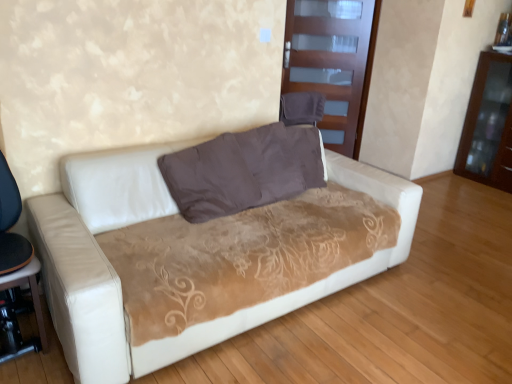
Find the location of a particular element. This screenshot has width=512, height=384. brown suede pillow at center is located at coordinates (283, 160).

This screenshot has height=384, width=512. What do you see at coordinates (333, 62) in the screenshot?
I see `transparent glass door at upper center` at bounding box center [333, 62].

Measure the distance between point (328, 104) and camera.

A distance of 4.40 meters exists between point (328, 104) and camera.

The image size is (512, 384). What do you see at coordinates (488, 124) in the screenshot?
I see `brown glossy dresser at right` at bounding box center [488, 124].

Identify the location of white leather couch at center. (199, 257).

The image size is (512, 384). I want to click on brown suede pillow at center, so click(283, 160).

Between point (395, 259) and point (318, 150), which one is positioned in front?

The point (395, 259) is closer.

Is white leather couch at center further to camera compared to brown suede pillow at center?

No, white leather couch at center is closer to the viewer.

In terms of width, does white leather couch at center look wider or thinner when compared to brown suede pillow at center?

Considering their sizes, white leather couch at center looks broader than brown suede pillow at center.

From a real-world perspective, which is physically above, white leather couch at center or brown suede pillow at center?

In real-world perspective, brown suede pillow at center is above.

Does brown suede pillow at center have a lesser width compared to white leather couch at center?

Yes, brown suede pillow at center is thinner than white leather couch at center.

Is brown suede pillow at center facing away from white leather couch at center?

Yes.

Does point (305, 131) come closer to viewer compared to point (65, 171)?

No, it is behind (65, 171).

Which is more to the left, brown glossy dresser at right or transparent glass door at upper center?

transparent glass door at upper center.

You are a GUI agent. You are given a task and a screenshot of the screen. Output one action in this format:
    pyautogui.click(x=<x>, y=<y>)
    Task: Click on the dresser in front of the transparent glass door at upper center
    
    Given the screenshot: What is the action you would take?
    pyautogui.click(x=488, y=124)

Between brown glossy dresser at right and transparent glass door at upper center, which one has more height?

Standing taller between the two is transparent glass door at upper center.

Does white leather couch at center lie behind transparent glass door at upper center?

No.

Is white leather couch at center spatially inside transparent glass door at upper center, or outside of it?

white leather couch at center cannot be found inside transparent glass door at upper center.

This screenshot has height=384, width=512. Identify the location of studio couch lying below the transparent glass door at upper center (from the image's perspective). (199, 257).

Is white leather couch at center positioned with its back to transparent glass door at upper center?

No.

Where is `table in front of the brown glossy dresser at right`? This screenshot has width=512, height=384. table in front of the brown glossy dresser at right is located at coordinates (19, 285).

Is brown glossy dresser at right looking in the opposite direction of black plastic table at lower left?

brown glossy dresser at right is not turned away from black plastic table at lower left.

In the scene shown: What's the angular difference between brown glossy dresser at right and black plastic table at lower left's facing directions?

The facing directions of brown glossy dresser at right and black plastic table at lower left are 92.9 degrees apart.

Considering the sizes of objects brown glossy dresser at right and black plastic table at lower left in the image provided, who is taller, brown glossy dresser at right or black plastic table at lower left?

brown glossy dresser at right.

Is transparent glass door at upper center looking in the opposite direction of brown suede pillow at center?

No, transparent glass door at upper center is not facing the opposite direction of brown suede pillow at center.

Which is in front, point (312, 18) or point (295, 181)?

The point (295, 181) is more forward.

From a real-world perspective, between transparent glass door at upper center and brown suede pillow at center, who is vertically lower?

brown suede pillow at center.

Is transparent glass door at upper center far away from brown suede pillow at center?

transparent glass door at upper center is positioned a significant distance from brown suede pillow at center.

Considering the relative sizes of black plastic table at lower left and transparent glass door at upper center in the image provided, is black plastic table at lower left shorter than transparent glass door at upper center?

Yes.

Is black plastic table at lower left oriented away from transparent glass door at upper center?

That's not correct — black plastic table at lower left is not looking away from transparent glass door at upper center.

Is black plastic table at lower left completely or partially outside of transparent glass door at upper center?

Yes, black plastic table at lower left is outside of transparent glass door at upper center.

The height and width of the screenshot is (384, 512). What are the coordinates of `studio couch below the brown suede pillow at center (from a real-world perspective)` in the screenshot? It's located at (199, 257).

The height and width of the screenshot is (384, 512). I want to click on studio couch below the brown suede pillow at center (from the image's perspective), so click(199, 257).

Which object lies further to the anchor point brown glossy dresser at right, white leather couch at center or brown suede pillow at center?

Based on the image, white leather couch at center appears to be further to brown glossy dresser at right.

Which object lies further to the anchor point brown suede pillow at center, white leather couch at center or black plastic table at lower left?

black plastic table at lower left.

Based on their spatial positions, is transparent glass door at upper center or black plastic table at lower left further from brown glossy dresser at right?

Among the two, black plastic table at lower left is located further to brown glossy dresser at right.

Based on the photo, considering their positions, is transparent glass door at upper center positioned further to black plastic table at lower left than white leather couch at center?

transparent glass door at upper center.

From the picture: From the image, which object appears to be farther from white leather couch at center, brown suede pillow at center or brown glossy dresser at right?

brown glossy dresser at right lies further to white leather couch at center than the other object.

Considering their positions, is brown suede pillow at center positioned closer to transparent glass door at upper center than white leather couch at center?

→ The object closer to transparent glass door at upper center is brown suede pillow at center.

Consider the image. Based on their spatial positions, is brown glossy dresser at right or black plastic table at lower left further from white leather couch at center?

brown glossy dresser at right is further to white leather couch at center.

Considering their positions, is white leather couch at center positioned further to black plastic table at lower left than brown glossy dresser at right?

Based on the image, brown glossy dresser at right appears to be further to black plastic table at lower left.

Locate an element on the screen. glass door between brown suede pillow at center and brown glossy dresser at right from left to right is located at coordinates pos(333,62).

You are a GUI agent. You are given a task and a screenshot of the screen. Output one action in this format:
    pyautogui.click(x=<x>, y=<y>)
    Task: Click on the pillow between white leather couch at center and transparent glass door at upper center from front to back
    The width and height of the screenshot is (512, 384).
    Given the screenshot: What is the action you would take?
    pyautogui.click(x=283, y=160)

Find the location of `glass door between black plastic table at lower left and brown glossy dresser at right in the horizontal direction`. glass door between black plastic table at lower left and brown glossy dresser at right in the horizontal direction is located at coordinates (333, 62).

Find the location of a particular element. The height and width of the screenshot is (384, 512). table located between white leather couch at center and transparent glass door at upper center in the depth direction is located at coordinates (19, 285).